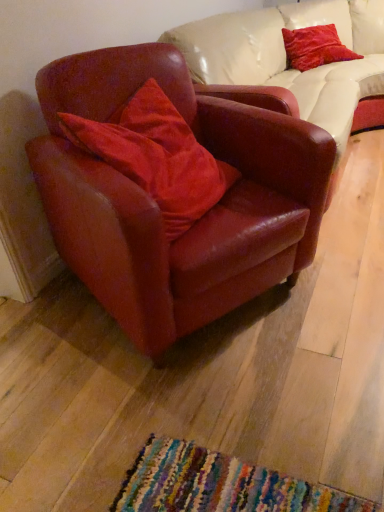
Question: Should I look upward or downward to see velvet red pillow at center, which is the first pillow in front-to-back order?

Choices:
 (A) down
 (B) up

Answer: (B)

Question: Does velvet red pillow at center, which appears as the 1th pillow when ordered from the bottom, appear on the right side of velvet red pillow at upper right, which ranks as the first pillow in right-to-left order?

Choices:
 (A) yes
 (B) no

Answer: (B)

Question: Does velvet red pillow at center, which is the first pillow in front-to-back order, have a greater height compared to velvet red pillow at upper right, arranged as the 2th pillow when ordered from the bottom?

Choices:
 (A) yes
 (B) no

Answer: (A)

Question: Is velvet red pillow at center, acting as the 2th pillow starting from the top, facing towards velvet red pillow at upper right, the second pillow viewed from the front?

Choices:
 (A) no
 (B) yes

Answer: (A)

Question: Can you confirm if velvet red pillow at center, which is counted as the 2th pillow, starting from the back, is smaller than velvet red pillow at upper right, the 2th pillow from the left?

Choices:
 (A) no
 (B) yes

Answer: (A)

Question: From the image's perspective, is velvet red pillow at center, acting as the 2th pillow starting from the top, on velvet red pillow at upper right, which ranks as the first pillow in right-to-left order?

Choices:
 (A) no
 (B) yes

Answer: (A)

Question: From a real-world perspective, is velvet red pillow at center, which ranks as the 2th pillow in right-to-left order, physically below velvet red pillow at upper right, arranged as the 2th pillow when ordered from the bottom?

Choices:
 (A) yes
 (B) no

Answer: (B)

Question: Is velvet red pillow at center, arranged as the first pillow when viewed from the left, outside leather armchair at left?

Choices:
 (A) no
 (B) yes

Answer: (A)

Question: Is velvet red pillow at center, arranged as the first pillow when viewed from the left, not close to leather armchair at left?

Choices:
 (A) yes
 (B) no

Answer: (B)

Question: From the image's perspective, is velvet red pillow at center, which appears as the 1th pillow when ordered from the bottom, above leather armchair at left?

Choices:
 (A) no
 (B) yes

Answer: (B)

Question: Can you confirm if velvet red pillow at center, which is the first pillow in front-to-back order, is thinner than leather armchair at left?

Choices:
 (A) yes
 (B) no

Answer: (A)

Question: Is velvet red pillow at center, acting as the 2th pillow starting from the top, looking in the opposite direction of leather armchair at left?

Choices:
 (A) no
 (B) yes

Answer: (B)

Question: Is velvet red pillow at center, arranged as the first pillow when viewed from the left, in contact with leather armchair at left?

Choices:
 (A) no
 (B) yes

Answer: (A)

Question: Is leather armchair at left smaller than velvet red pillow at center, which is counted as the 2th pillow, starting from the back?

Choices:
 (A) no
 (B) yes

Answer: (A)